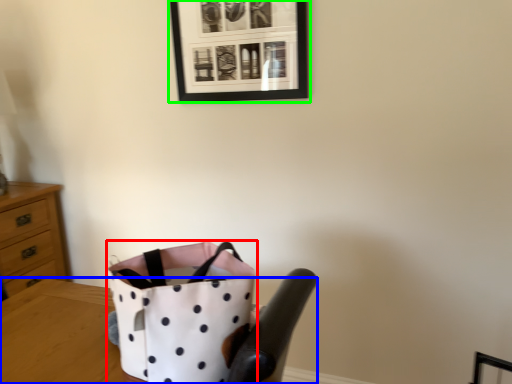
Question: Based on their relative distances, which object is farther from handbag (highlighted by a red box)? Choose from table (highlighted by a blue box) and picture frame (highlighted by a green box).

Choices:
 (A) table
 (B) picture frame

Answer: (B)